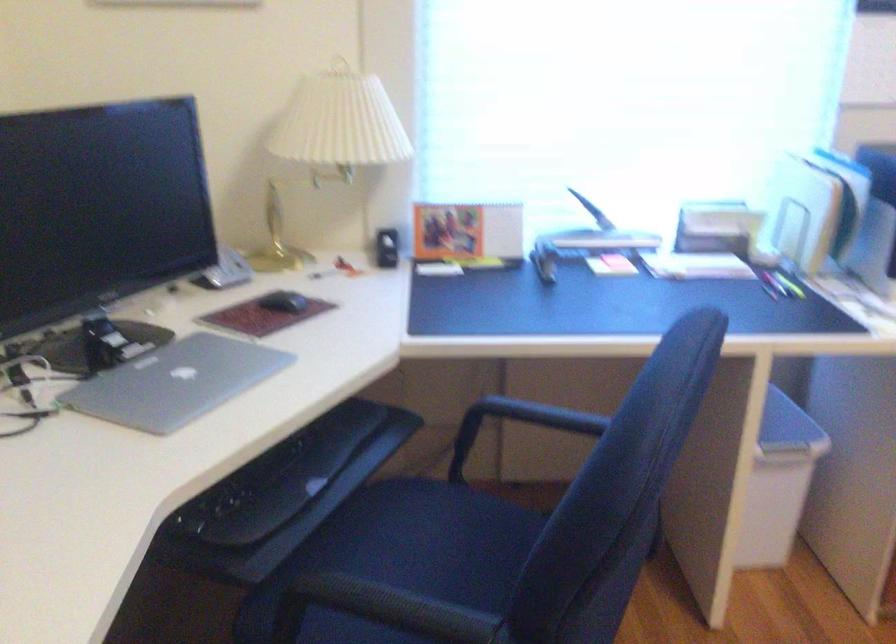
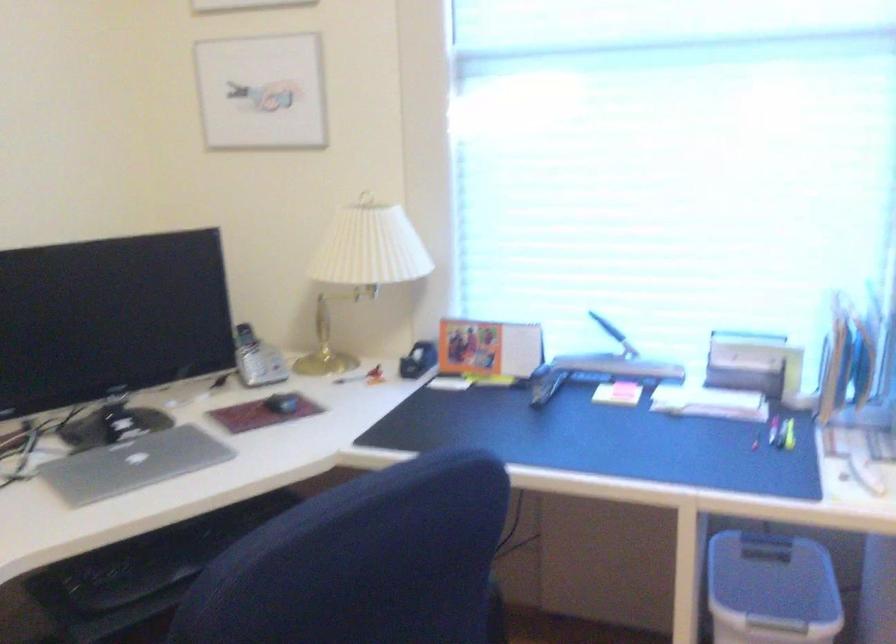
In the second image, find the point that corresponds to point (219, 258) in the first image.

(256, 359)